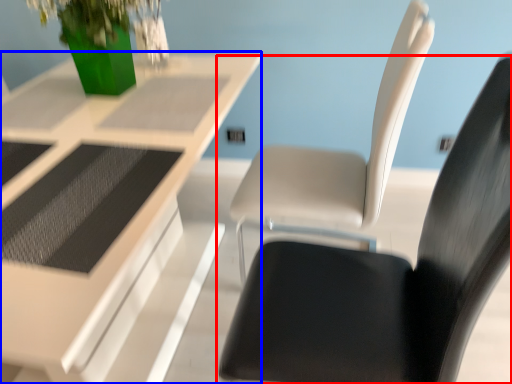
Question: Which point is further to the camera, chair (highlighted by a red box) or table (highlighted by a blue box)?

Choices:
 (A) chair
 (B) table

Answer: (B)